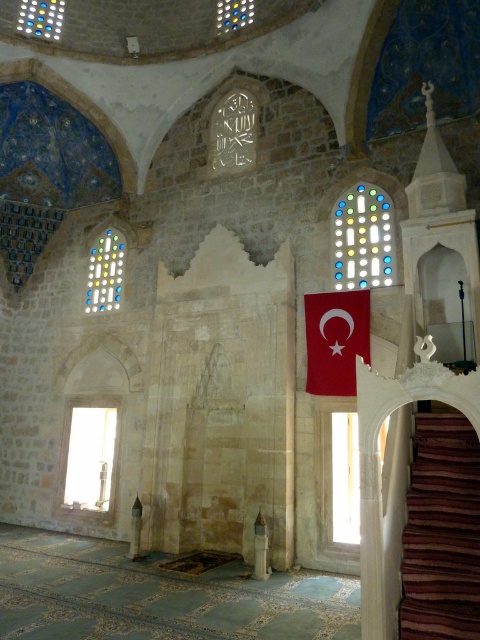
Question: From the image, what is the correct spatial relationship of transparent glass window at left in relation to transparent glass door at center?

Choices:
 (A) right
 (B) left

Answer: (B)

Question: Considering the relative positions of multicolored stained glass at upper center and transparent glass window at left in the image provided, where is multicolored stained glass at upper center located with respect to transparent glass window at left?

Choices:
 (A) above
 (B) below

Answer: (A)

Question: Which object is closer to the camera taking this photo?

Choices:
 (A) multicolored stained glass at upper left
 (B) red matte flag at center
 (C) multicolored stained glass at upper center

Answer: (B)

Question: Which is nearer to the multicolored stained glass at upper left?

Choices:
 (A) multicolored stained glass at upper center
 (B) brown wooden stairs at lower right
 (C) transparent glass window at left
 (D) transparent glass door at center

Answer: (C)

Question: Is multicolored stained glass at upper center above multicolored stained glass at upper left?

Choices:
 (A) yes
 (B) no

Answer: (A)

Question: Which of the following is the closest to the observer?

Choices:
 (A) multicolored stained glass at upper left
 (B) multicolored stained glass at upper center
 (C) translucent glass window at upper left
 (D) transparent glass door at center

Answer: (D)